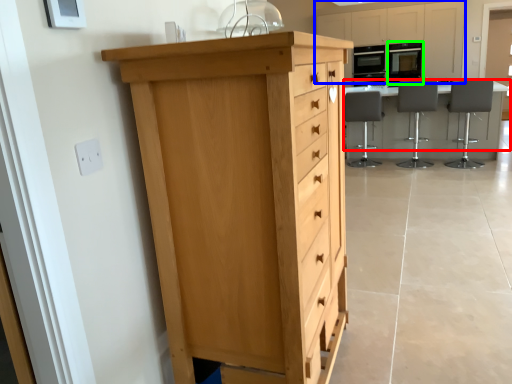
Question: Which is nearer to the table (highlighted by a red box)? cabinetry (highlighted by a blue box) or appliance (highlighted by a green box).

Choices:
 (A) cabinetry
 (B) appliance

Answer: (B)